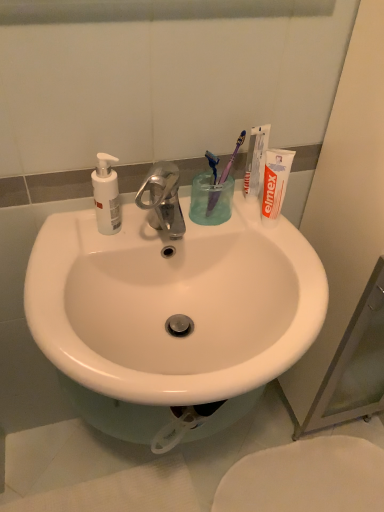
Where is `free space above white glossy toilet at lower right (from a real-world perspective)`? free space above white glossy toilet at lower right (from a real-world perspective) is located at coordinates (308, 478).